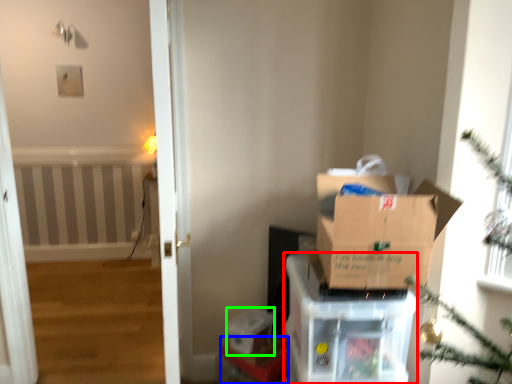
Question: Estimate the real-world distances between objects in this image. Which object is closer to cardboard box (highlighted by a red box), furniture (highlighted by a blue box) or storage box (highlighted by a green box)?

Choices:
 (A) furniture
 (B) storage box

Answer: (A)